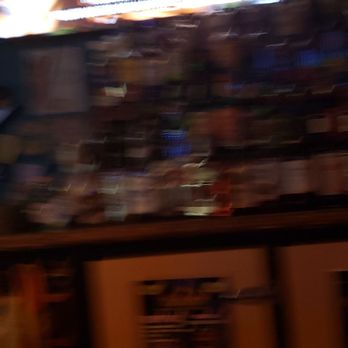
Image resolution: width=348 pixels, height=348 pixels. I want to click on shelf, so click(x=169, y=227).